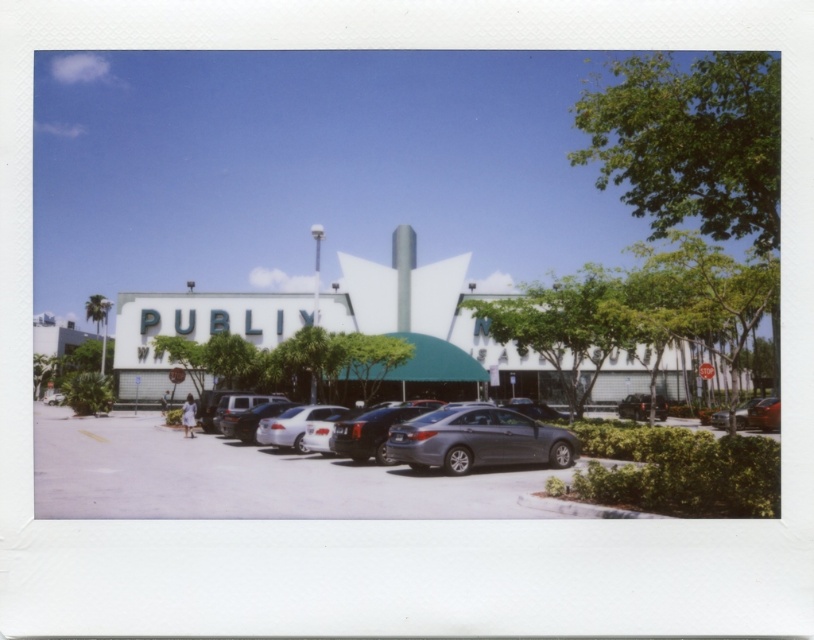
Is matte gray sedan at center shorter than satin gray sedan at center?

No, matte gray sedan at center is not shorter than satin gray sedan at center.

Between matte gray sedan at center and satin gray sedan at center, which one appears on the right side from the viewer's perspective?

Positioned to the right is satin gray sedan at center.

What do you see at coordinates (453, 436) in the screenshot?
I see `matte gray sedan at center` at bounding box center [453, 436].

Identify the location of matte gray sedan at center. pyautogui.click(x=453, y=436).

Is the position of matte gray sedan at center less distant than that of satin silver sedan at center?

Yes, it is in front of satin silver sedan at center.

Does matte gray sedan at center appear over satin silver sedan at center?

Correct, matte gray sedan at center is located above satin silver sedan at center.

Who is more distant from viewer, [458,422] or [259,444]?

The point [259,444] is more distant.

Where is `matte gray sedan at center`? The width and height of the screenshot is (814, 640). matte gray sedan at center is located at coordinates (453, 436).

Looking at this image, can you confirm if gray asphalt parking lot at center is smaller than satin gray sedan at center?

No, gray asphalt parking lot at center is not smaller than satin gray sedan at center.

Does gray asphalt parking lot at center have a greater width compared to satin gray sedan at center?

Yes, gray asphalt parking lot at center is wider than satin gray sedan at center.

Describe the element at coordinates (241, 477) in the screenshot. I see `gray asphalt parking lot at center` at that location.

Find the location of a particular element. gray asphalt parking lot at center is located at coordinates (241, 477).